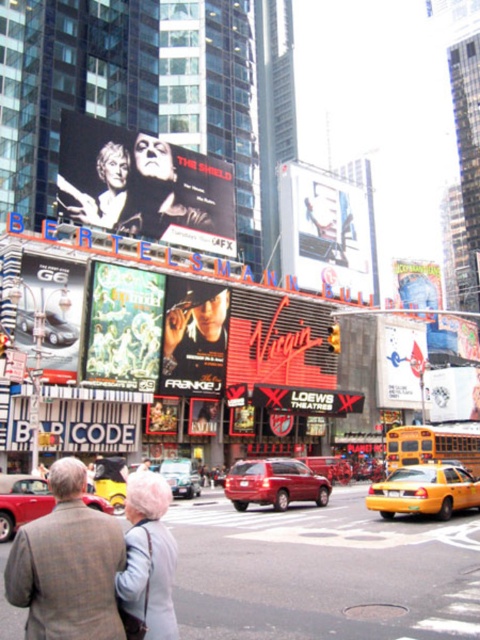
Is matte black face at upper center bigger than metallic red car at center?

No, matte black face at upper center is not bigger than metallic red car at center.

What do you see at coordinates (105, 193) in the screenshot?
I see `matte black face at upper center` at bounding box center [105, 193].

At what (x,y) coordinates should I click in order to perform the action: click on matte black face at upper center. Please return your answer as a coordinate pair (x, y). Looking at the image, I should click on (105, 193).

Find the location of a particular element. Image resolution: width=480 pixels, height=640 pixels. metallic silver sign at upper center is located at coordinates (324, 230).

Which is more to the left, metallic silver sign at upper center or metallic silver car at left?

From the viewer's perspective, metallic silver car at left appears more on the left side.

Locate an element on the screen. metallic silver sign at upper center is located at coordinates (324, 230).

Who is more distant from viewer, (x=397, y=493) or (x=402, y=282)?

Point (x=402, y=282)

How far apart are yellow matte taxi at center-right and metallic silver sign at upper right?

yellow matte taxi at center-right and metallic silver sign at upper right are 54.25 meters apart.

Image resolution: width=480 pixels, height=640 pixels. Identify the location of yellow matte taxi at center-right. (424, 492).